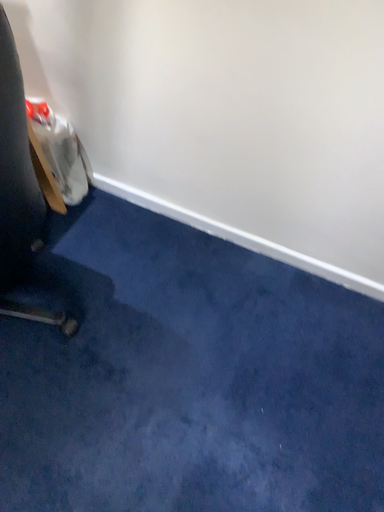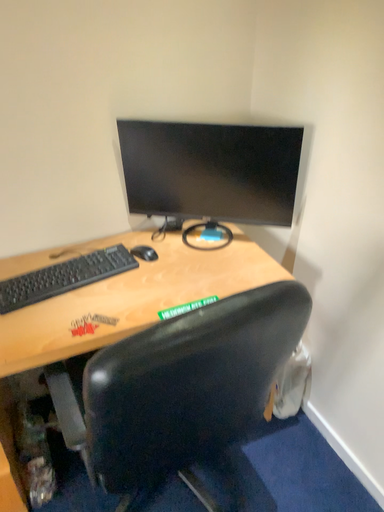
Question: Which way did the camera rotate in the video?

Choices:
 (A) rotated upward
 (B) rotated downward

Answer: (A)